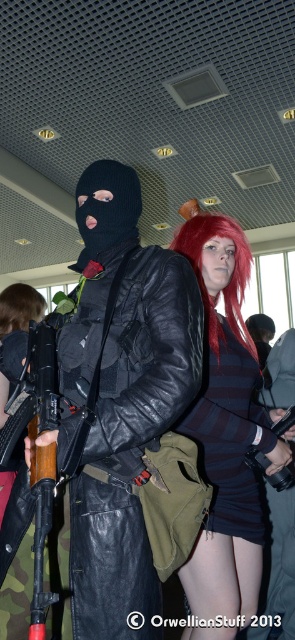
Does striped fabric skirt at center appear under matte black gun at center?

No, striped fabric skirt at center is not below matte black gun at center.

Does striped fabric skirt at center appear on the left side of matte black gun at center?

Indeed, striped fabric skirt at center is positioned on the left side of matte black gun at center.

Is point (235, 518) farther from camera compared to point (276, 424)?

That is False.

You are a GUI agent. You are given a task and a screenshot of the screen. Output one action in this format:
    pyautogui.click(x=<x>, y=<y>)
    Task: Click on the striped fabric skirt at center
    The width and height of the screenshot is (295, 640).
    Given the screenshot: What is the action you would take?
    pyautogui.click(x=230, y=436)

Which of these two, matte black leather jacket at center or shiny red wig at center, stands taller?

Standing taller between the two is shiny red wig at center.

Can you confirm if matte black leather jacket at center is positioned to the right of shiny red wig at center?

In fact, matte black leather jacket at center is to the left of shiny red wig at center.

Which is in front, point (135, 484) or point (220, 385)?

Positioned in front is point (135, 484).

At what (x,y) coordinates should I click in order to perform the action: click on matte black leather jacket at center. Please return your answer as a coordinate pair (x, y). Looking at the image, I should click on (120, 417).

The image size is (295, 640). Describe the element at coordinates (226, 433) in the screenshot. I see `shiny red wig at center` at that location.

This screenshot has height=640, width=295. I want to click on shiny red wig at center, so click(226, 433).